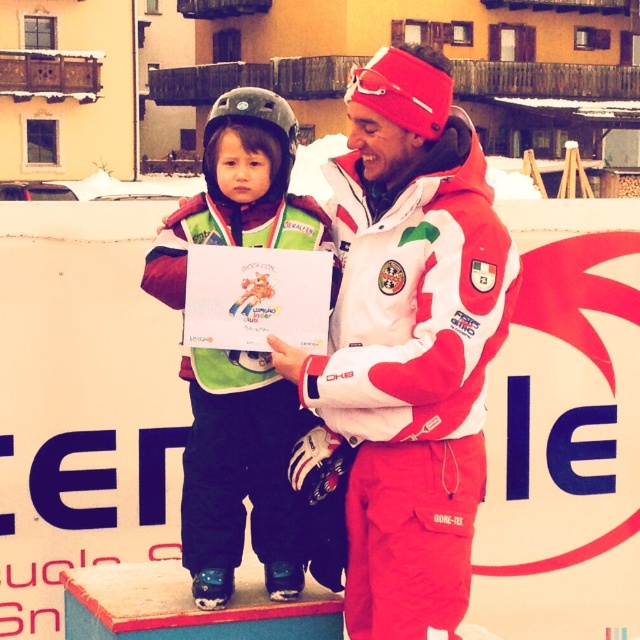
Is white/red ski suit at center below matte gray helmet at upper center?

Yes.

Is point (372, 616) positioned in front of point (276, 129)?

That is True.

Is point (308, 496) positioned before point (244, 106)?

That is False.

The width and height of the screenshot is (640, 640). I want to click on white/red ski suit at center, so click(406, 348).

Is white/red ski suit at center bigger than matte green snowsuit at center?

No, white/red ski suit at center is not bigger than matte green snowsuit at center.

Measure the distance from white/red ski suit at center to matte green snowsuit at center.

They are 33.93 inches apart.

Does point (472, 330) come in front of point (220, 188)?

Yes, point (472, 330) is in front of point (220, 188).

Locate an element on the screen. The height and width of the screenshot is (640, 640). white/red ski suit at center is located at coordinates (406, 348).

Based on the photo, is matte green snowsuit at center positioned before matte gray helmet at upper center?

Yes.

Does matte green snowsuit at center appear over matte gray helmet at upper center?

No.

Does point (252, 147) lie behind point (211, 193)?

No, (252, 147) is closer to viewer.

Image resolution: width=640 pixels, height=640 pixels. What are the coordinates of `matte green snowsuit at center` in the screenshot? It's located at (241, 474).